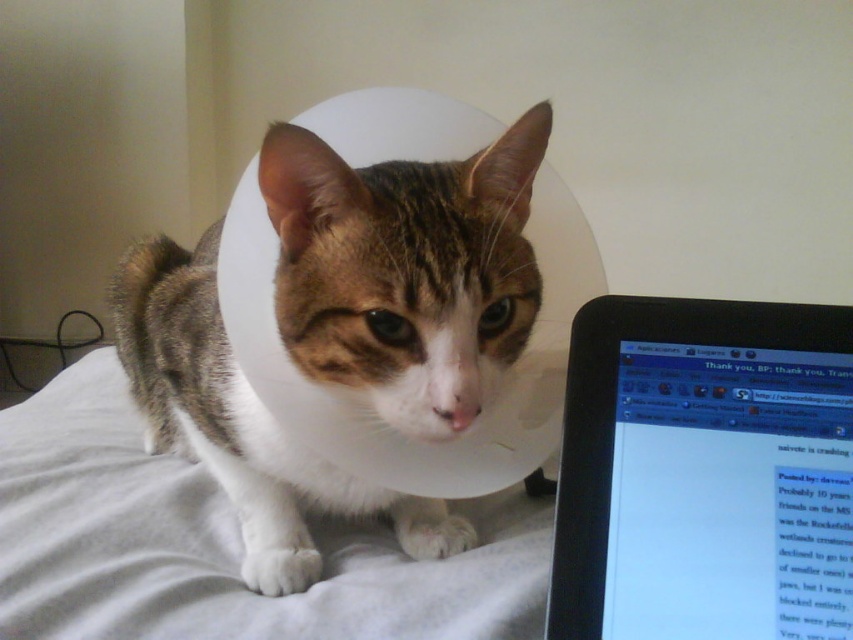
Question: Is tabby fur cat at center bigger than black glossy laptop at right?

Choices:
 (A) no
 (B) yes

Answer: (B)

Question: Does tabby fur cat at center appear on the right side of black glossy laptop at right?

Choices:
 (A) yes
 (B) no

Answer: (B)

Question: Which object appears farthest from the camera in this image?

Choices:
 (A) tabby fur cat at center
 (B) black glossy laptop at right

Answer: (A)

Question: Which point is closer to the camera?

Choices:
 (A) (833, 468)
 (B) (289, 298)

Answer: (A)

Question: Is tabby fur cat at center wider than black glossy laptop at right?

Choices:
 (A) no
 (B) yes

Answer: (B)